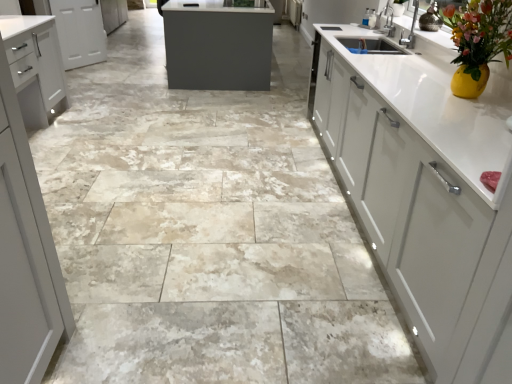
The image size is (512, 384). What are the coordinates of `vacant region under white matte cabinet at upper left, which appears as the second cabinetry when ordered from the bottom (from a real-world perspective)` in the screenshot? It's located at (83, 66).